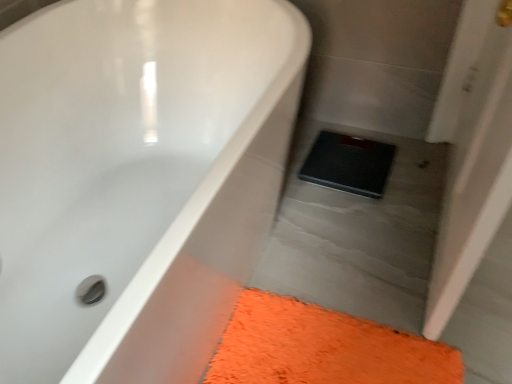
This screenshot has height=384, width=512. In order to click on vacant area to the right of black rubber scale at center in this screenshot , I will do `click(413, 165)`.